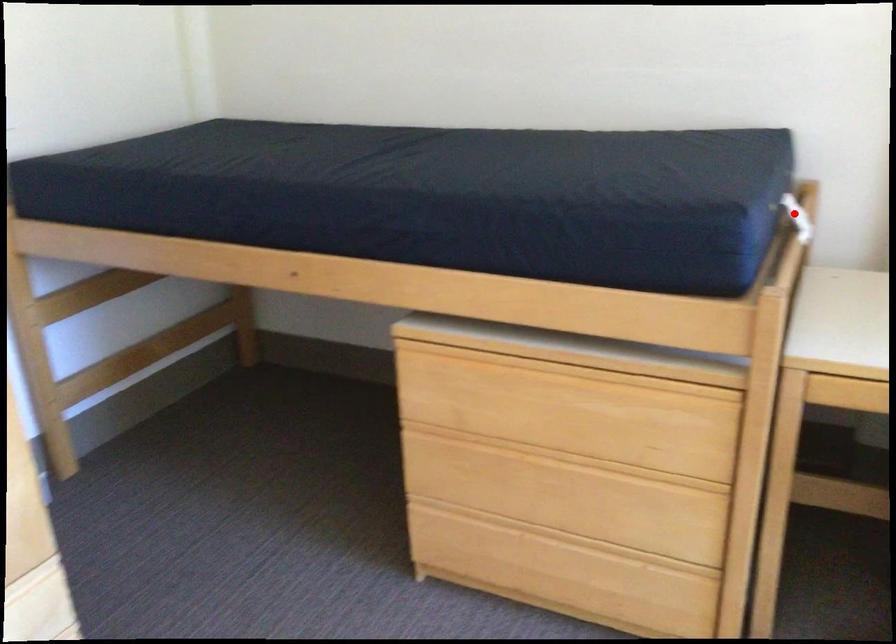
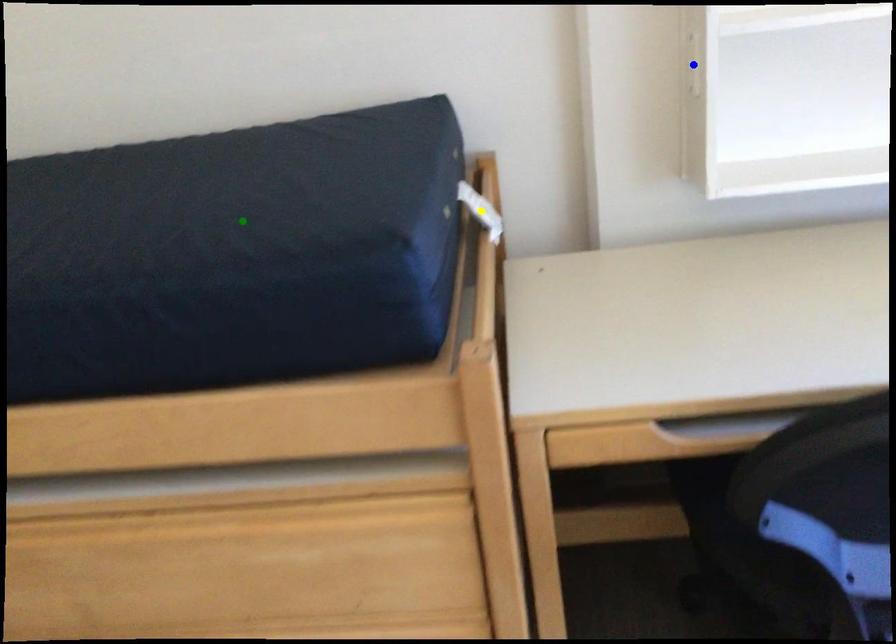
Question: I am providing you with two images of the same scene from different viewpoints. A red point is marked on the first image. You are given multiple points on the second image. In image 2, which mark is for the same physical point as the one in image 1?

Choices:
 (A) yellow point
 (B) green point
 (C) blue point

Answer: (A)